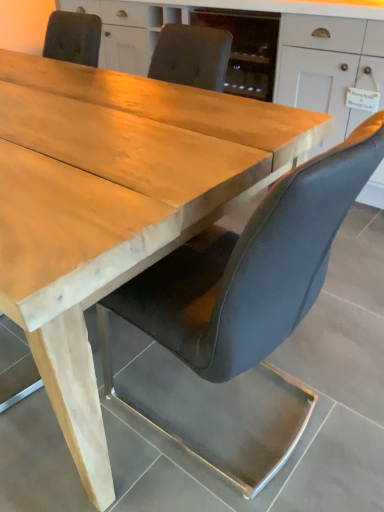
Question: Should I look upward or downward to see matte white cabinet at upper center?

Choices:
 (A) up
 (B) down

Answer: (A)

Question: From the image's perspective, is matte white cabinet at upper center on leather-like black chair at center?

Choices:
 (A) yes
 (B) no

Answer: (A)

Question: Does matte white cabinet at upper center have a greater height compared to leather-like black chair at center?

Choices:
 (A) no
 (B) yes

Answer: (B)

Question: Does matte white cabinet at upper center appear on the left side of leather-like black chair at center?

Choices:
 (A) yes
 (B) no

Answer: (B)

Question: Would you say matte white cabinet at upper center is a long distance from leather-like black chair at center?

Choices:
 (A) no
 (B) yes

Answer: (B)

Question: Can you confirm if matte white cabinet at upper center is wider than leather-like black chair at center?

Choices:
 (A) yes
 (B) no

Answer: (A)

Question: From a real-world perspective, is matte white cabinet at upper center on leather-like black chair at center?

Choices:
 (A) no
 (B) yes

Answer: (B)

Question: Is the position of leather-like black chair at center less distant than that of matte white cabinet at upper center?

Choices:
 (A) yes
 (B) no

Answer: (A)

Question: Is leather-like black chair at center located outside matte white cabinet at upper center?

Choices:
 (A) no
 (B) yes

Answer: (B)

Question: Is leather-like black chair at center next to matte white cabinet at upper center?

Choices:
 (A) yes
 (B) no

Answer: (B)

Question: Is leather-like black chair at center to the right of matte white cabinet at upper center from the viewer's perspective?

Choices:
 (A) no
 (B) yes

Answer: (A)

Question: Can you confirm if leather-like black chair at center is thinner than matte white cabinet at upper center?

Choices:
 (A) yes
 (B) no

Answer: (A)

Question: Does leather-like black chair at center come behind matte white cabinet at upper center?

Choices:
 (A) yes
 (B) no

Answer: (B)

Question: From a real-world perspective, is leather-like black chair at center above or below matte white cabinet at upper center?

Choices:
 (A) below
 (B) above

Answer: (A)